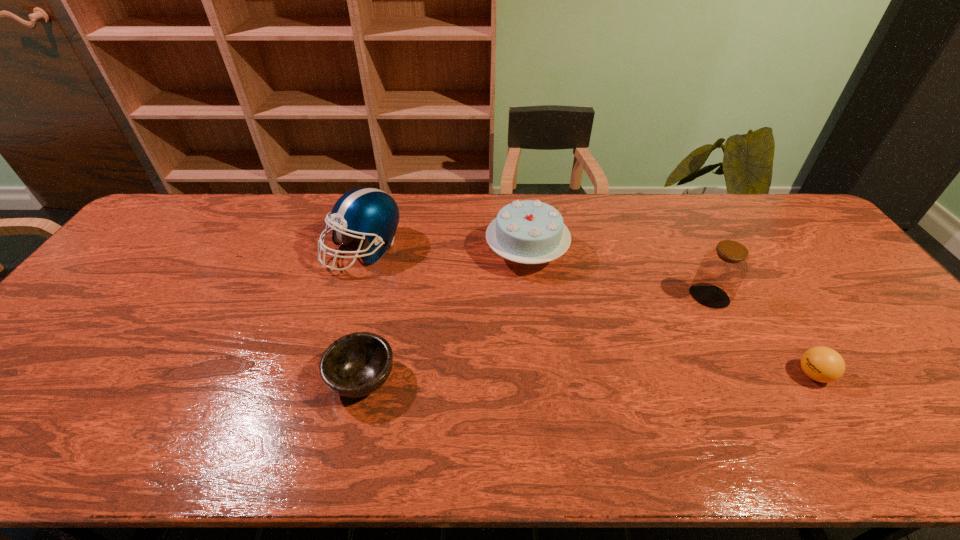
Find the location of a particular element. free space located 0.190m on the side with brand of the ping-pong ball is located at coordinates (716, 375).

This screenshot has width=960, height=540. I want to click on free space located 0.220m on the side with brand of the ping-pong ball, so click(704, 375).

This screenshot has width=960, height=540. Identify the location of free space located on the right of the bowl. (541, 379).

At what (x,y) coordinates should I click in order to perform the action: click on football helmet that is at the far edge. Please return your answer as a coordinate pair (x, y). The width and height of the screenshot is (960, 540). Looking at the image, I should click on (370, 213).

You are a GUI agent. You are given a task and a screenshot of the screen. Output one action in this format:
    pyautogui.click(x=<x>, y=<y>)
    Task: Click on the birthday cake present at the far edge
    This screenshot has height=540, width=960.
    Given the screenshot: What is the action you would take?
    click(531, 232)

Image resolution: width=960 pixels, height=540 pixels. I want to click on free location at the far edge, so click(727, 216).

This screenshot has height=540, width=960. What are the coordinates of `free space at the near edge of the desktop` in the screenshot? It's located at (736, 428).

In the image, there is a desktop. Where is `vacant space at the left edge`? The width and height of the screenshot is (960, 540). vacant space at the left edge is located at coordinates (34, 389).

Identify the location of vacant space at the right edge of the desktop. click(x=827, y=252).

In the image, there is a desktop. Identify the location of free region at the far left corner. This screenshot has width=960, height=540. (170, 225).